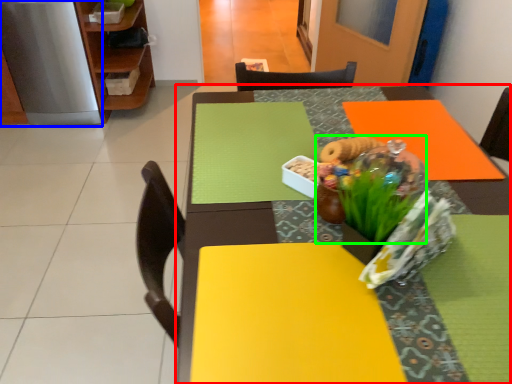
Question: Considering the real-world distances, which object is closest to table (highlighted by a red box)? appliance (highlighted by a blue box) or floral arrangement (highlighted by a green box).

Choices:
 (A) appliance
 (B) floral arrangement

Answer: (B)